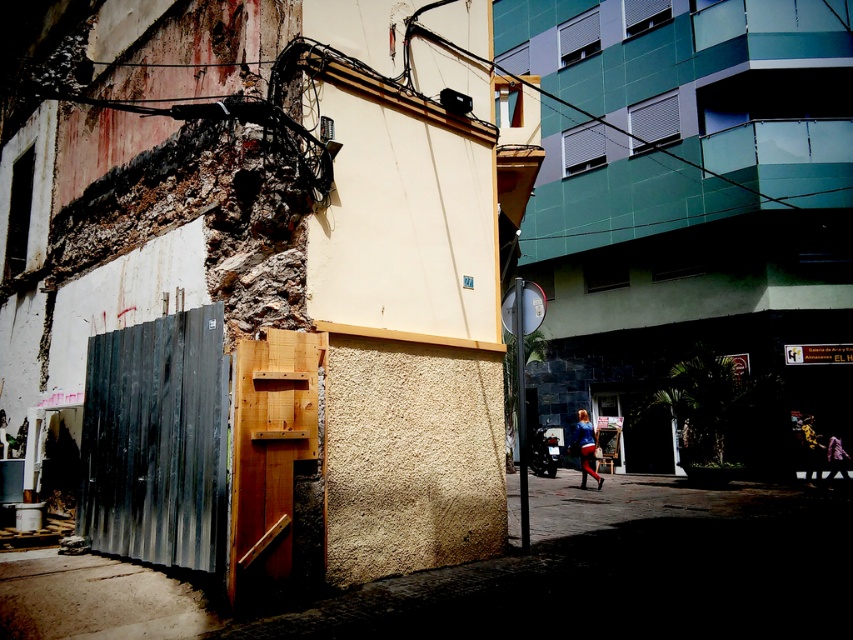
You are a delivery person who needs to place a small package on the blue fabric skirt at lower center. However, there is a metallic gold helmet at center in the way. Can you place the package on the skirt without moving the helmet?

The blue fabric skirt at lower center is much taller than the metallic gold helmet at center, so you can place the package on top of the skirt since it is higher than the helmet.

You are a delivery person who needs to choose between the metallic gold helmet at center and the leather jacket at center to protect yourself from rain. Which item is narrower and thus easier to store in your small delivery bag?

The metallic gold helmet at center is narrower than the leather jacket at center, so it would be easier to store in the small delivery bag.